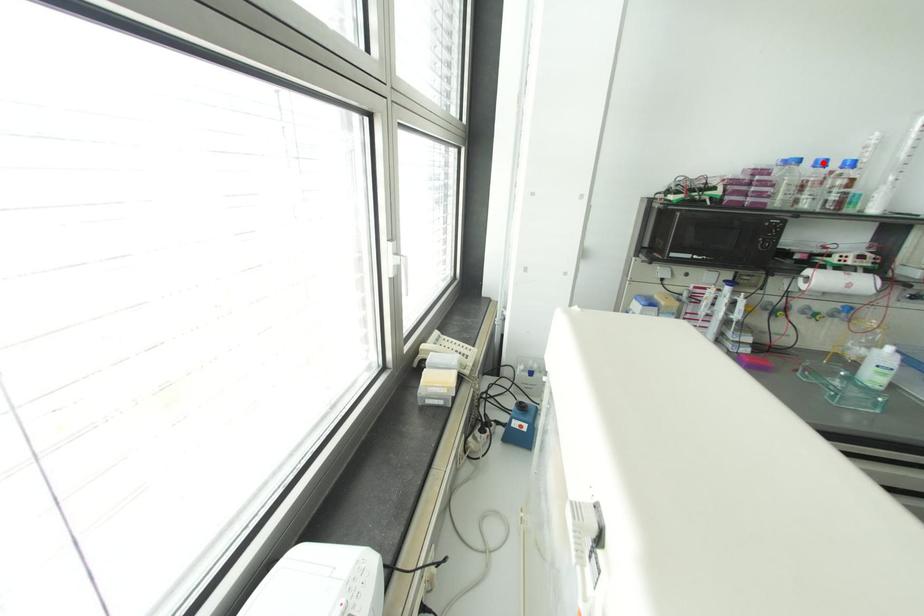
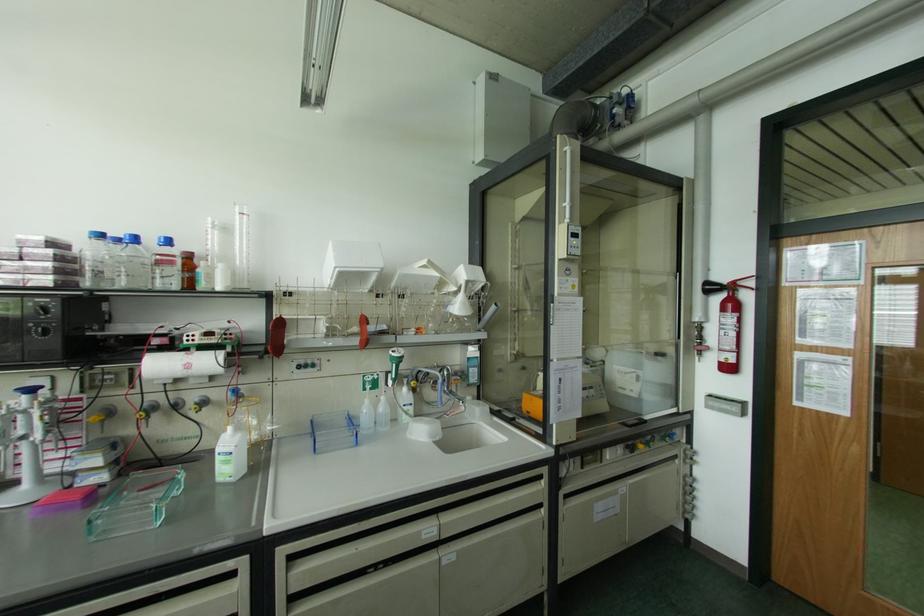
In the second image, find the point that corresponds to the highlighted location in the first image.

(134, 238)